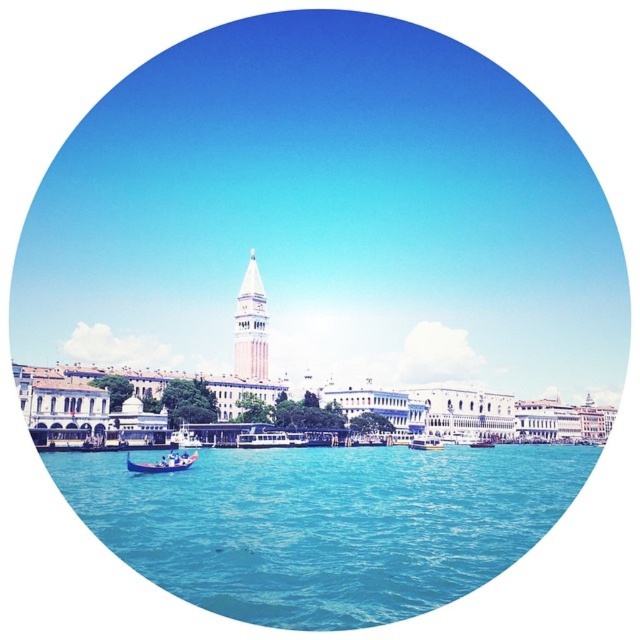
Can you confirm if clear blue water at lower center is taller than metallic silver boat at center?

Indeed, clear blue water at lower center has a greater height compared to metallic silver boat at center.

Does clear blue water at lower center appear on the left side of metallic silver boat at center?

Indeed, clear blue water at lower center is positioned on the left side of metallic silver boat at center.

Image resolution: width=640 pixels, height=640 pixels. In order to click on clear blue water at lower center in this screenshot , I will do `click(324, 524)`.

The width and height of the screenshot is (640, 640). Find the location of `white marble bell tower at center`. white marble bell tower at center is located at coordinates (250, 326).

Which is behind, point (244, 280) or point (419, 445)?

The point (244, 280) is more distant.

Describe the element at coordinates (250, 326) in the screenshot. I see `white marble bell tower at center` at that location.

Identify the location of white marble bell tower at center. (250, 326).

From the picture: Between wooden gondola at center and metallic silver boat at center, which one has less height?

metallic silver boat at center is shorter.

Does point (419, 435) come in front of point (483, 442)?

Yes, it is in front of point (483, 442).

Image resolution: width=640 pixels, height=640 pixels. Identify the location of wooden gondola at center. (426, 442).